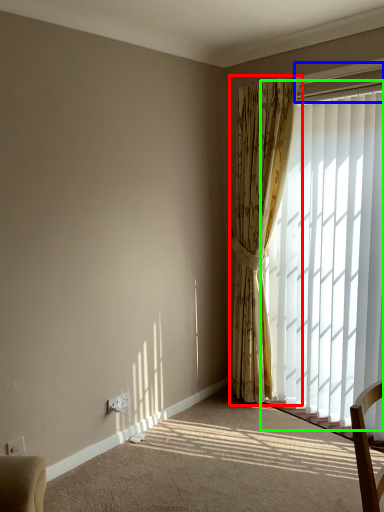
Question: Which object is the farthest from curtain (highlighted by a red box)? Choose among these: window frame (highlighted by a blue box) or window (highlighted by a green box).

Choices:
 (A) window frame
 (B) window

Answer: (A)